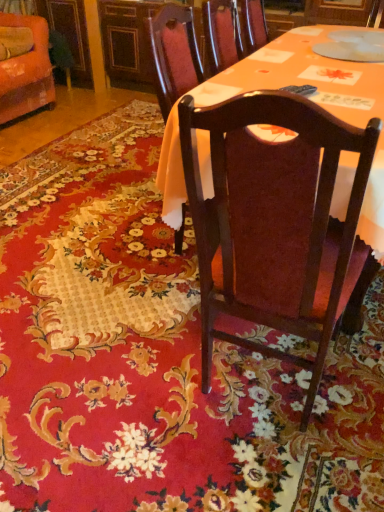
At what (x,y) coordinates should I click in order to perform the action: click on free location in front of dark wood chair at center, acting as the second chair starting from the left. Please return your answer as a coordinate pair (x, y). This screenshot has height=512, width=384. Looking at the image, I should click on point(266,471).